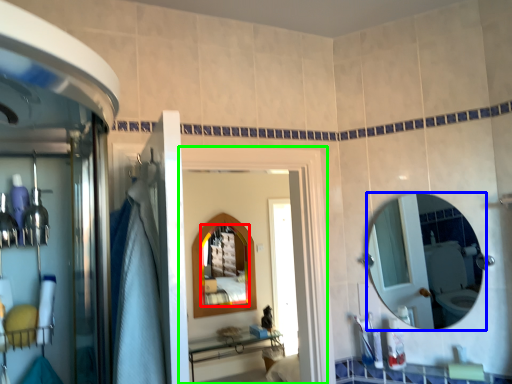
Question: Which object is positioned farthest from mirror (highlighted by a red box)? Select from mirror (highlighted by a blue box) and screen door (highlighted by a green box).

Choices:
 (A) mirror
 (B) screen door

Answer: (B)